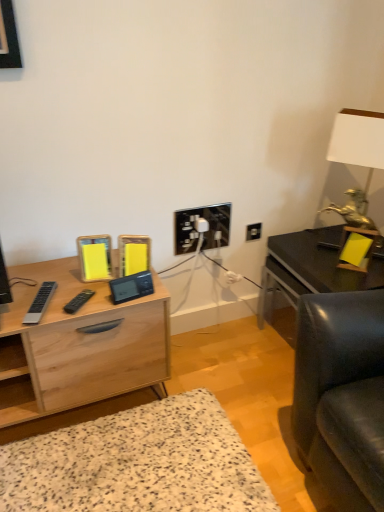
At what (x,y) coordinates should I click in order to perform the action: click on free point above light wood desk at center (from a real-world perspective). Please return your answer as a coordinate pair (x, y). Looking at the image, I should click on (60, 289).